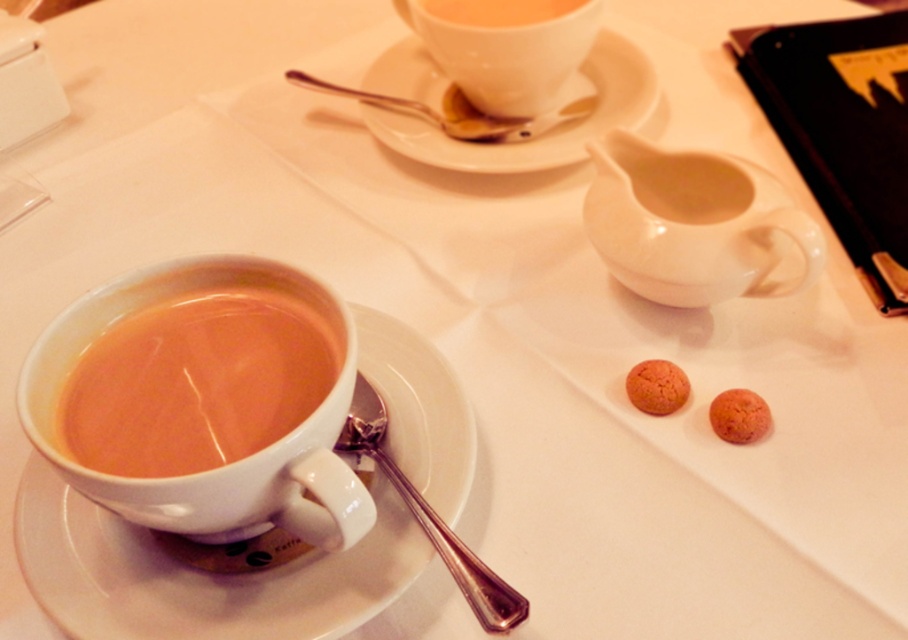
Is white ceramic saucer at upper center above matte white teacup at upper center?

Incorrect, white ceramic saucer at upper center is not positioned above matte white teacup at upper center.

Who is lower down, white ceramic saucer at upper center or matte white teacup at upper center?

Positioned lower is white ceramic saucer at upper center.

Find the location of a particular element. The width and height of the screenshot is (908, 640). white ceramic saucer at upper center is located at coordinates (536, 125).

What do you see at coordinates (692, 224) in the screenshot?
I see `white glossy creamer at upper right` at bounding box center [692, 224].

Is white glossy creamer at upper right positioned in front of matte white teacup at upper center?

Yes.

Between point (643, 177) and point (516, 104), which one is positioned behind?

The point (516, 104) is more distant.

Locate an element on the screen. white glossy creamer at upper right is located at coordinates (692, 224).

The image size is (908, 640). What do you see at coordinates (196, 381) in the screenshot?
I see `matte white cup of tea at lower left` at bounding box center [196, 381].

Between point (63, 408) and point (509, 627), which one is positioned behind?

The point (63, 408) is more distant.

You are a GUI agent. You are given a task and a screenshot of the screen. Output one action in this format:
    pyautogui.click(x=<x>, y=<y>)
    Task: Click on the matte white cup of tea at lower left
    This screenshot has width=908, height=640.
    Given the screenshot: What is the action you would take?
    pyautogui.click(x=196, y=381)

The height and width of the screenshot is (640, 908). I want to click on matte white cup of tea at lower left, so click(196, 381).